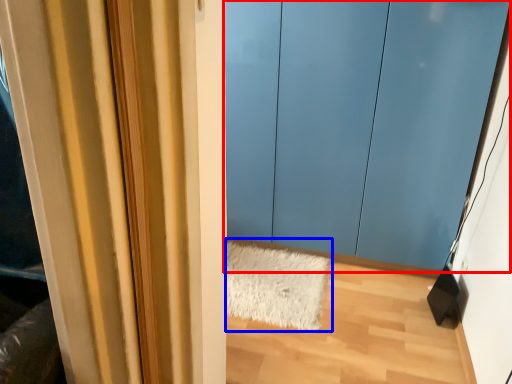
Question: Which point is closer to the camera, door (highlighted by a red box) or doormat (highlighted by a blue box)?

Choices:
 (A) door
 (B) doormat

Answer: (A)